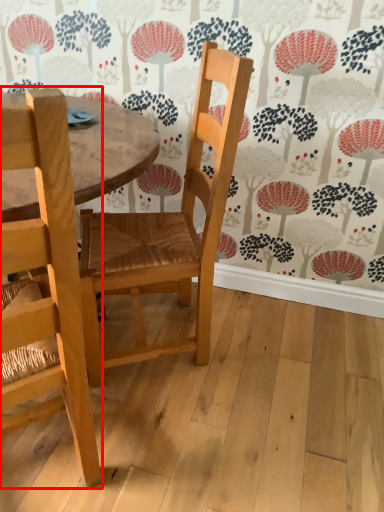
Question: From the image's perspective, where is chair (annotated by the red box) located relative to chair?

Choices:
 (A) above
 (B) below

Answer: (B)